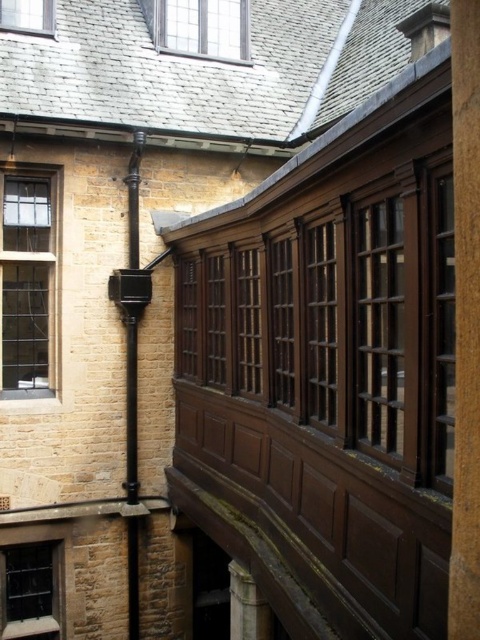
Is clear glass window at left to the left of clear glass window at upper center from the viewer's perspective?

Indeed, clear glass window at left is positioned on the left side of clear glass window at upper center.

Which of these two, clear glass window at left or clear glass window at upper center, stands shorter?

clear glass window at upper center

The image size is (480, 640). I want to click on clear glass window at left, so click(27, 280).

Is point (2, 186) behind point (14, 16)?

No, (2, 186) is in front of (14, 16).

Describe the element at coordinates (27, 280) in the screenshot. I see `clear glass window at left` at that location.

The height and width of the screenshot is (640, 480). In order to click on clear glass window at left in this screenshot , I will do `click(27, 280)`.

Is clear glass window at left wider than matte glass window at lower left?

Incorrect, clear glass window at left's width does not surpass matte glass window at lower left's.

Does clear glass window at left appear under matte glass window at lower left?

Actually, clear glass window at left is above matte glass window at lower left.

At what (x,y) coordinates should I click in order to perform the action: click on clear glass window at left. Please return your answer as a coordinate pair (x, y). The width and height of the screenshot is (480, 640). Looking at the image, I should click on (27, 280).

Find the location of a particular element. clear glass window at left is located at coordinates (27, 280).